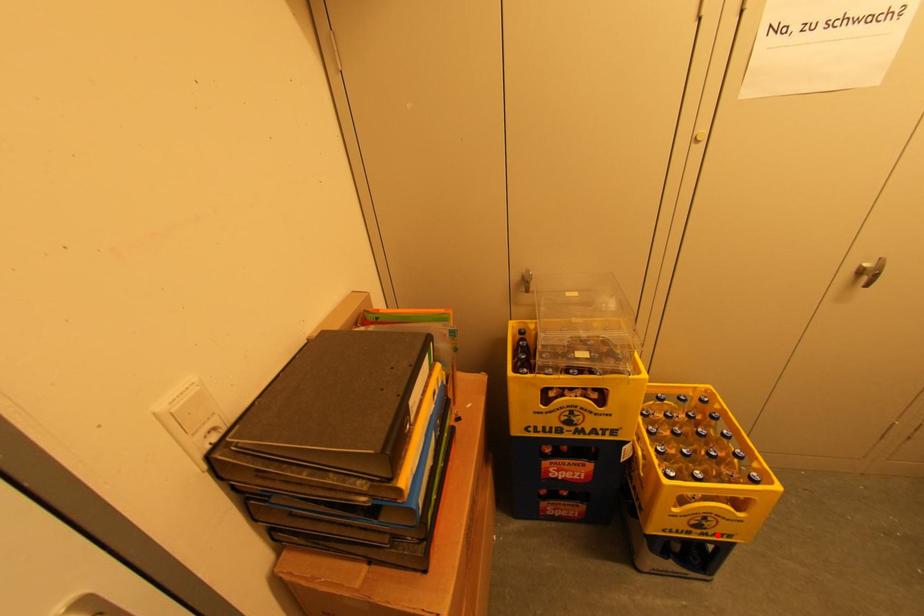
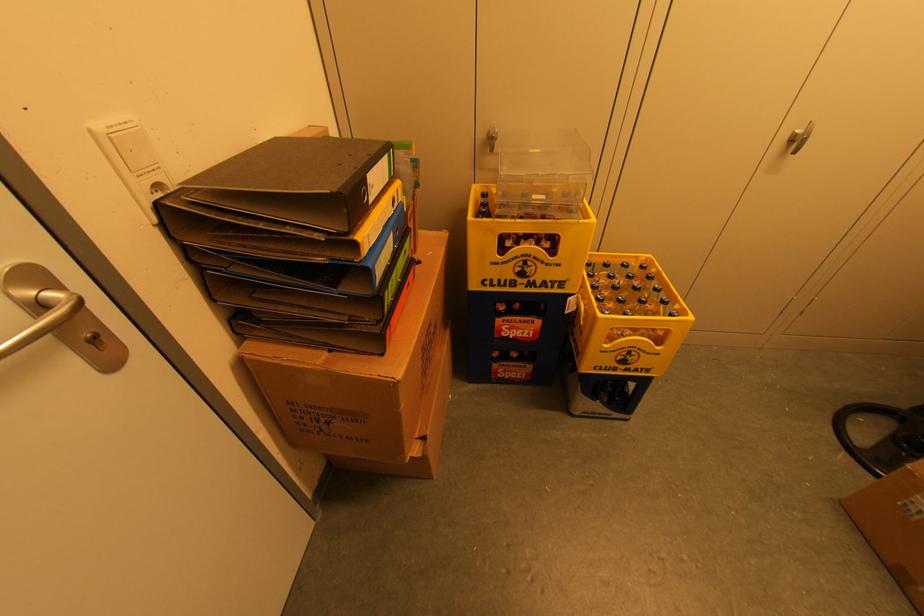
Question: I am providing you with two images of the same scene from different viewpoints. Given a red point in image1, look at the same physical point in image2. Is it:

Choices:
 (A) Closer to the viewpoint
 (B) Farther from the viewpoint

Answer: (B)